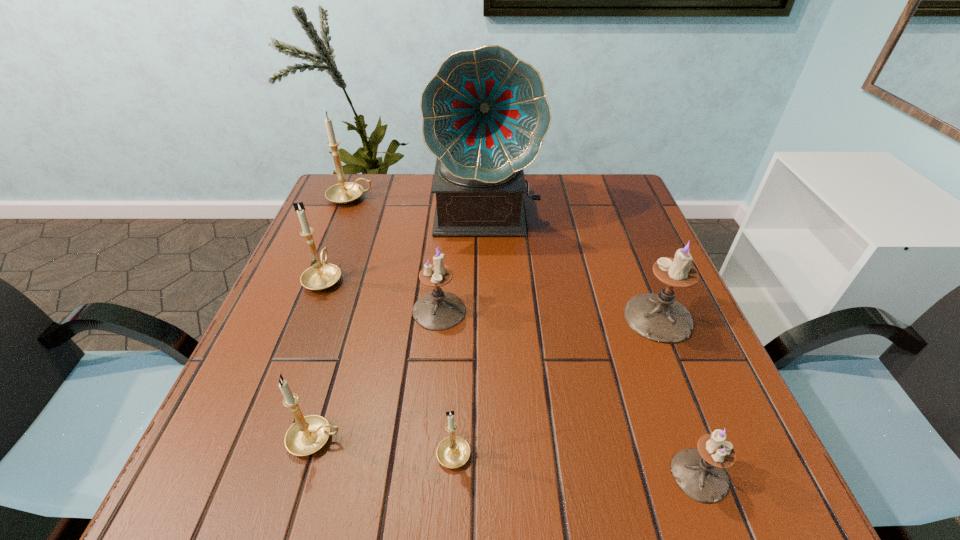
Locate an element on the screen. This screenshot has width=960, height=540. free space between the second farthest gold candle holder and the biggest purple candle holder is located at coordinates (492, 298).

Where is `free space between the biggest purple candle holder and the third nearest gold candle holder`? The height and width of the screenshot is (540, 960). free space between the biggest purple candle holder and the third nearest gold candle holder is located at coordinates (492, 298).

At what (x,y) coordinates should I click in order to perform the action: click on the fifth closest object to the smallest gold candle holder. Please return your answer as a coordinate pair (x, y). This screenshot has width=960, height=540. Looking at the image, I should click on (322, 275).

Locate an element on the screen. This screenshot has height=540, width=960. the third closest object to the record player is located at coordinates (322, 275).

Identify which candle holder is located as the sixth nearest to the second biggest purple candle holder. Please provide its 2D coordinates. Your answer should be formatted as a tuple, i.e. [(x, y)], where the tuple contains the x and y coordinates of a point satisfying the conditions above.

[(699, 473)]

Identify the location of the fourth closest candle holder relative to the second smallest gold candle holder. Image resolution: width=960 pixels, height=540 pixels. (699, 473).

Identify which gold candle holder is the second nearest to the third biggest gold candle holder. Please provide its 2D coordinates. Your answer should be formatted as a tuple, i.e. [(x, y)], where the tuple contains the x and y coordinates of a point satisfying the conditions above.

[(322, 275)]

What are the coordinates of `gold candle holder that stands as the second closest to the biggest purple candle holder` in the screenshot? It's located at (307, 435).

You are a GUI agent. You are given a task and a screenshot of the screen. Output one action in this format:
    pyautogui.click(x=<x>, y=<y>)
    Task: Click on the purple candle holder identified as the second closest to the biggest purple candle holder
    This screenshot has height=540, width=960.
    Given the screenshot: What is the action you would take?
    (x=439, y=310)

At what (x,y) coordinates should I click in order to perform the action: click on the second closest purple candle holder to the nearest purple candle holder. Please return your answer as a coordinate pair (x, y). Looking at the image, I should click on (439, 310).